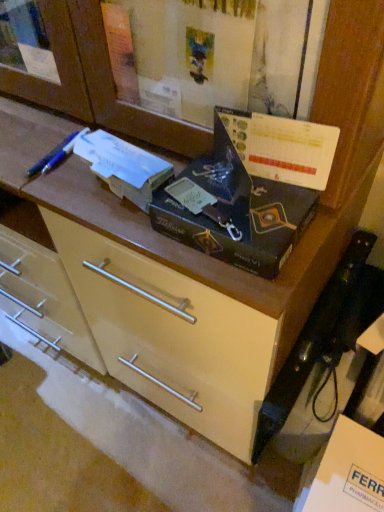
Question: Would you say matte cream drawer at center is inside or outside blue plastic pen at upper left?

Choices:
 (A) outside
 (B) inside

Answer: (A)

Question: Relative to blue plastic pen at upper left, is matte cream drawer at center in front or behind?

Choices:
 (A) front
 (B) behind

Answer: (B)

Question: Which of these objects is positioned closest to the matte black box at center?

Choices:
 (A) matte cream drawer at center
 (B) blue plastic pen at upper left
 (C) white cardboard box at lower right

Answer: (A)

Question: Which object is positioned farthest from the matte cream drawer at center?

Choices:
 (A) matte black box at center
 (B) white cardboard box at lower right
 (C) blue plastic pen at upper left

Answer: (C)